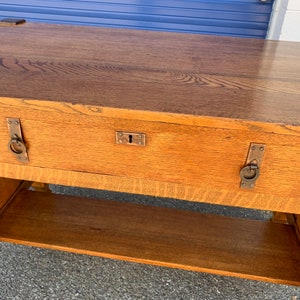
Where is `blue wall, metal`? Image resolution: width=300 pixels, height=300 pixels. blue wall, metal is located at coordinates (218, 22).